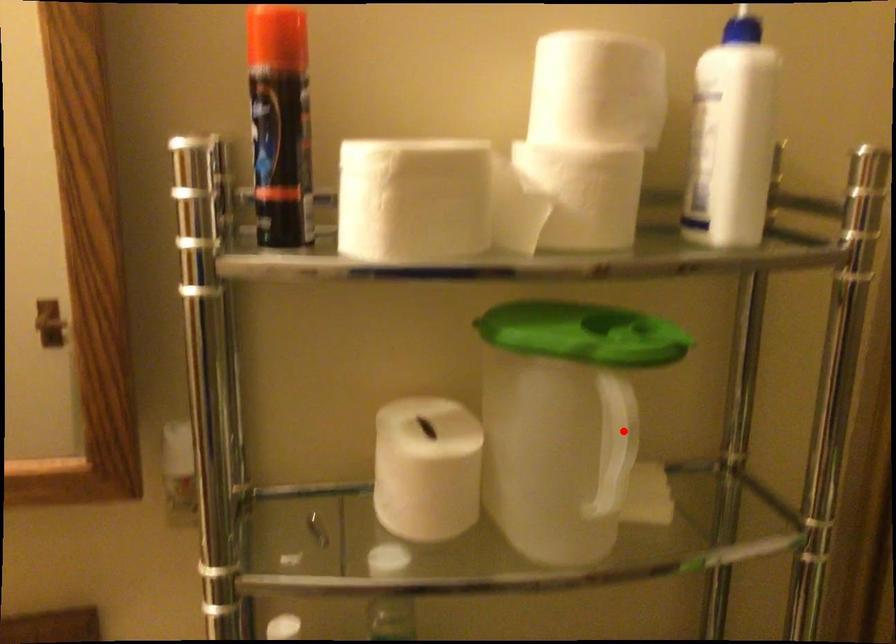
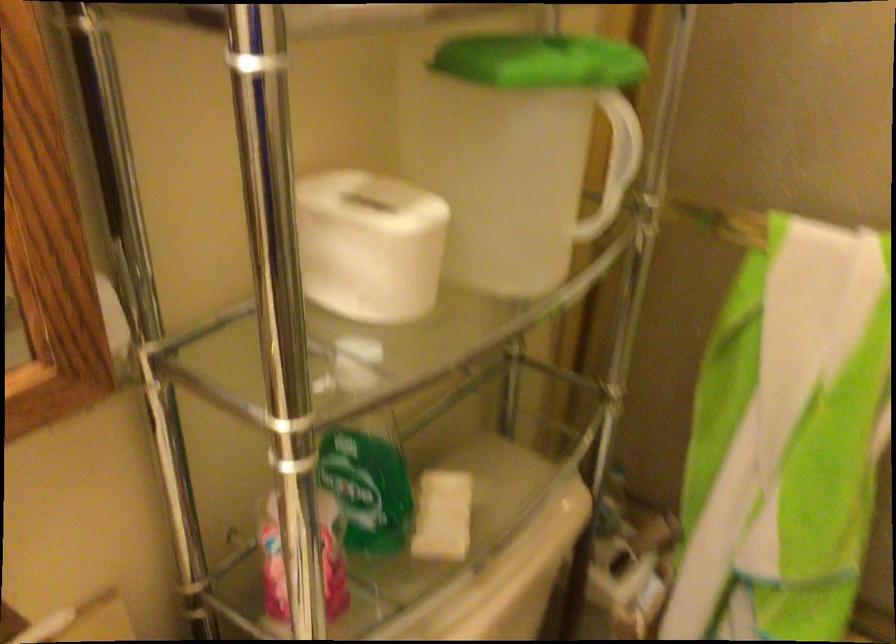
Where in the second image is the point corresponding to the highlighted location from the first image?

(618, 152)